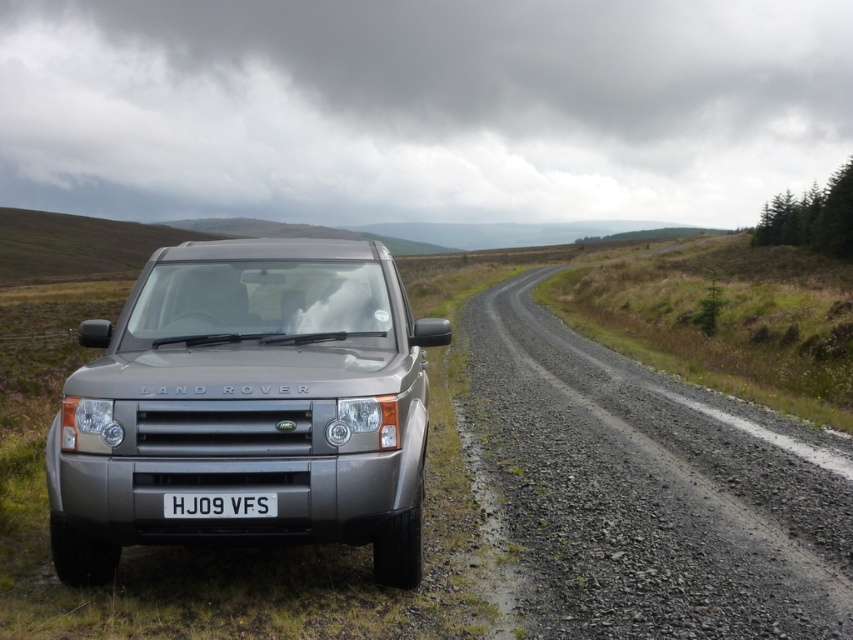
Is satin silver land rover at center further to camera compared to gravel road at center?

No, it is in front of gravel road at center.

Measure the distance between satin silver land rover at center and gravel road at center.

They are 4.65 meters apart.

Is point (86, 456) positioned in front of point (767, 448)?

Yes, it is in front of point (767, 448).

This screenshot has width=853, height=640. Identify the location of satin silver land rover at center. (248, 406).

Does satin silver land rover at center have a larger size compared to white plastic license plate at center?

Yes.

Who is lower down, satin silver land rover at center or white plastic license plate at center?

white plastic license plate at center is lower down.

Is point (379, 476) closer to viewer compared to point (250, 499)?

No, it is behind (250, 499).

Find the location of a particular element. The width and height of the screenshot is (853, 640). satin silver land rover at center is located at coordinates (248, 406).

Based on the photo, does gravel road at center have a smaller size compared to white plastic license plate at center?

No.

Does gravel road at center appear on the left side of white plastic license plate at center?

In fact, gravel road at center is to the right of white plastic license plate at center.

Find the location of a particular element. gravel road at center is located at coordinates (650, 490).